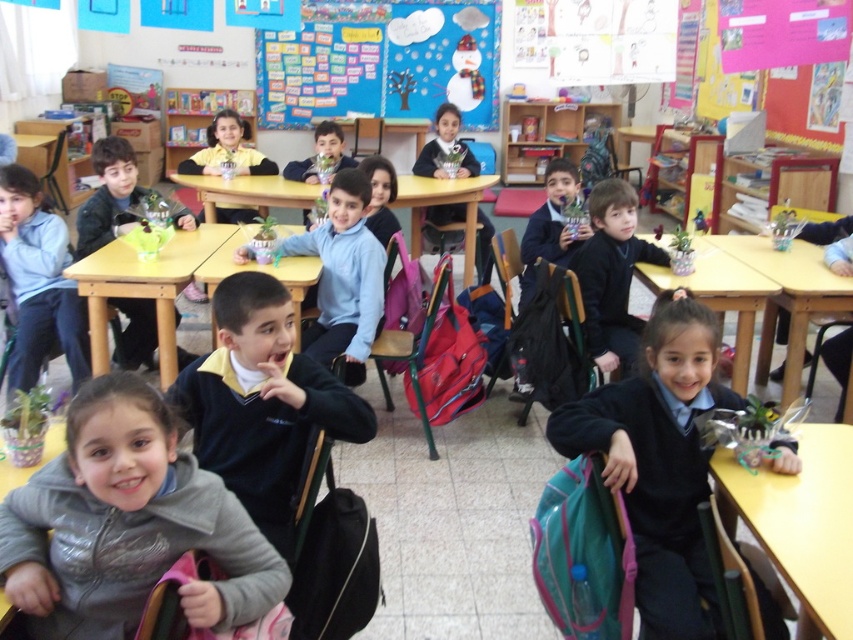
Question: Is black school uniform at lower right closer to camera compared to green plastic bag at lower right?

Choices:
 (A) no
 (B) yes

Answer: (A)

Question: Which is farther from the wooden table at lower right?

Choices:
 (A) black school uniform at lower right
 (B) matte wooden table at center

Answer: (B)

Question: Which point appears closest to the camera in this image?

Choices:
 (A) (352, 365)
 (B) (85, 266)

Answer: (B)

Question: Is dark blue sweater at center positioned at the back of yellow uniform shirt at center?

Choices:
 (A) no
 (B) yes

Answer: (A)

Question: Which object is farther from the camera taking this photo?

Choices:
 (A) yellow uniform shirt at center
 (B) dark blue backpack at center

Answer: (A)

Question: Does black school uniform at lower right have a lesser width compared to dark blue backpack at center?

Choices:
 (A) yes
 (B) no

Answer: (B)